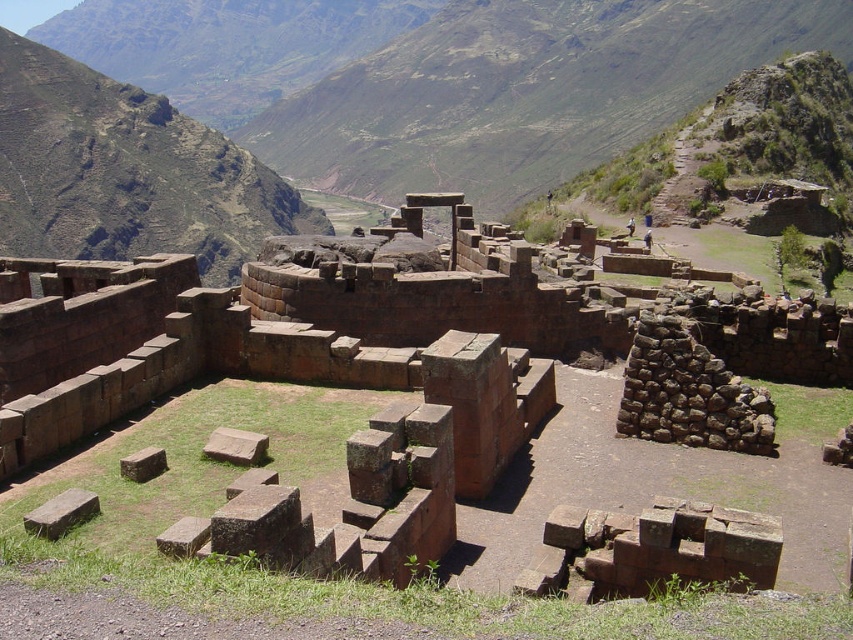
You are standing at the ancient Incan structure and want to walk towards the point that is closer to you. Which point should you walk towards, point (640,310) or point (86,211)?

Point (640,310) is in front of point (86,211), so you should walk towards point (640,310) because it is closer to you.

You are standing in the ancient stone structure and want to locate the brown stone ruins at center. According to the coordinates provided, where exactly would you find them?

The brown stone ruins at center are located at coordinates point (395, 340).